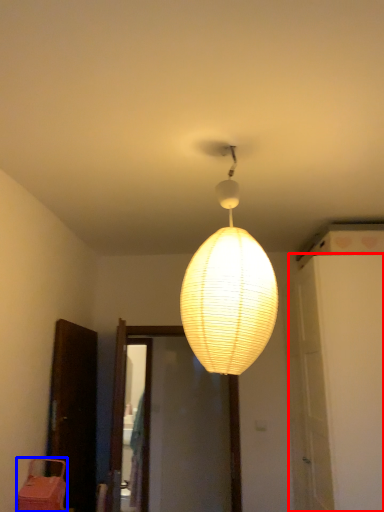
Question: Among these objects, which one is farthest to the camera, door (highlighted by a red box) or furniture (highlighted by a blue box)?

Choices:
 (A) door
 (B) furniture

Answer: (A)